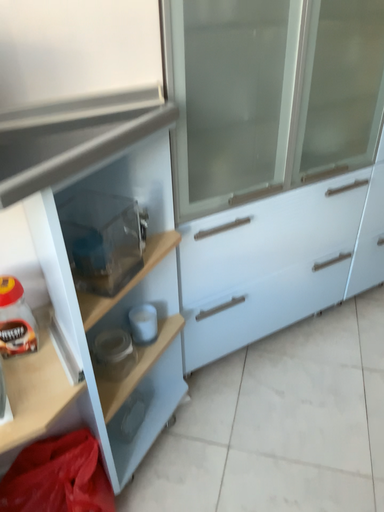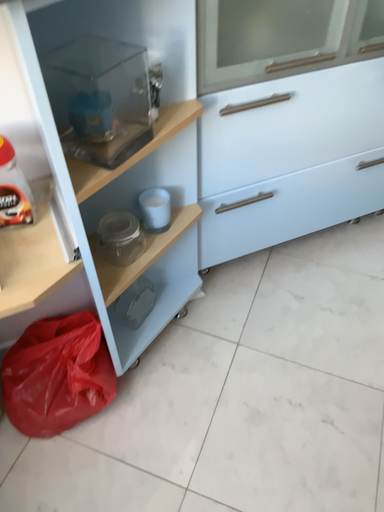
Question: Which way did the camera rotate in the video?

Choices:
 (A) rotated downward
 (B) rotated upward

Answer: (A)